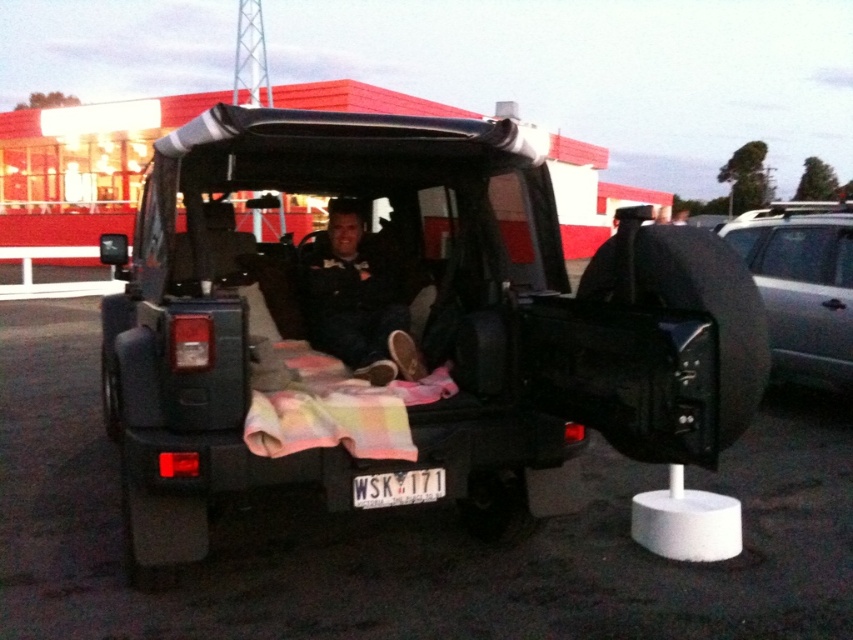
Can you confirm if matte black jeep at center is positioned to the left of silver metallic suv at right?

Yes, matte black jeep at center is to the left of silver metallic suv at right.

Locate an element on the screen. matte black jeep at center is located at coordinates (402, 332).

Who is more distant from viewer, (148, 342) or (809, 314)?

The point (809, 314) is more distant.

The height and width of the screenshot is (640, 853). Identify the location of matte black jeep at center. (402, 332).

Who is positioned more to the right, matte black jeep at center or white plastic license plate at center?

white plastic license plate at center

Between point (688, 259) and point (437, 490), which one is positioned in front?

Positioned in front is point (688, 259).

Locate an element on the screen. The width and height of the screenshot is (853, 640). matte black jeep at center is located at coordinates (402, 332).

Between point (753, 211) and point (415, 497), which one is positioned in front?

Point (415, 497)

Locate an element on the screen. silver metallic suv at right is located at coordinates (802, 285).

Who is more distant from viewer, (x=726, y=236) or (x=412, y=484)?

Point (x=726, y=236)

The image size is (853, 640). In order to click on silver metallic suv at right in this screenshot , I will do `click(802, 285)`.